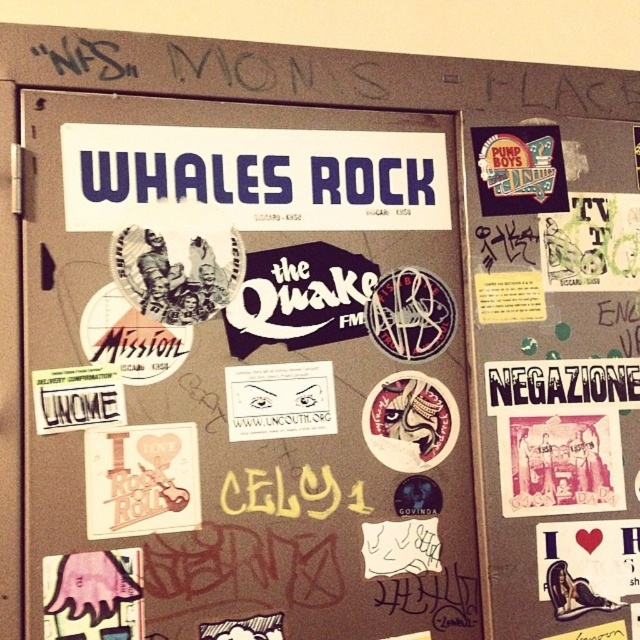
Question: Does matte black sticker at upper right have a larger size compared to white paper at upper center?

Choices:
 (A) no
 (B) yes

Answer: (B)

Question: Which of the following is the farthest from the observer?

Choices:
 (A) (611, 372)
 (B) (316, 472)
 (C) (477, 154)

Answer: (A)

Question: Is white paper at center wider than white paper at upper center?

Choices:
 (A) no
 (B) yes

Answer: (B)

Question: Based on their relative distances, which object is farther from the white paper at center?

Choices:
 (A) white paper at upper center
 (B) matte black sticker at upper right

Answer: (A)

Question: Which point is farther to the camera?

Choices:
 (A) (506, 625)
 (B) (61, 403)
 (C) (536, 404)

Answer: (C)

Question: Considering the relative positions of white paper at center and white paper at upper center in the image provided, where is white paper at center located with respect to white paper at upper center?

Choices:
 (A) above
 (B) below

Answer: (A)